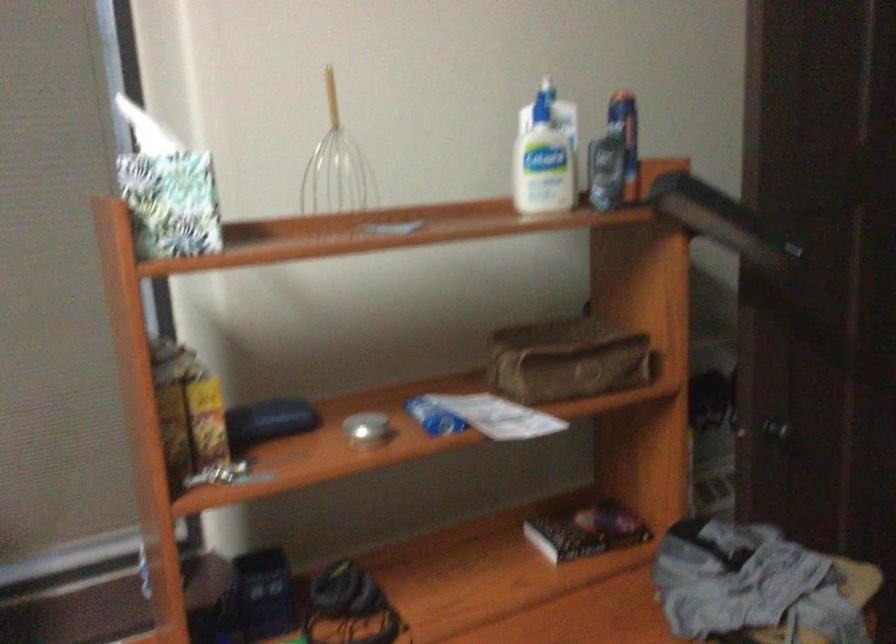
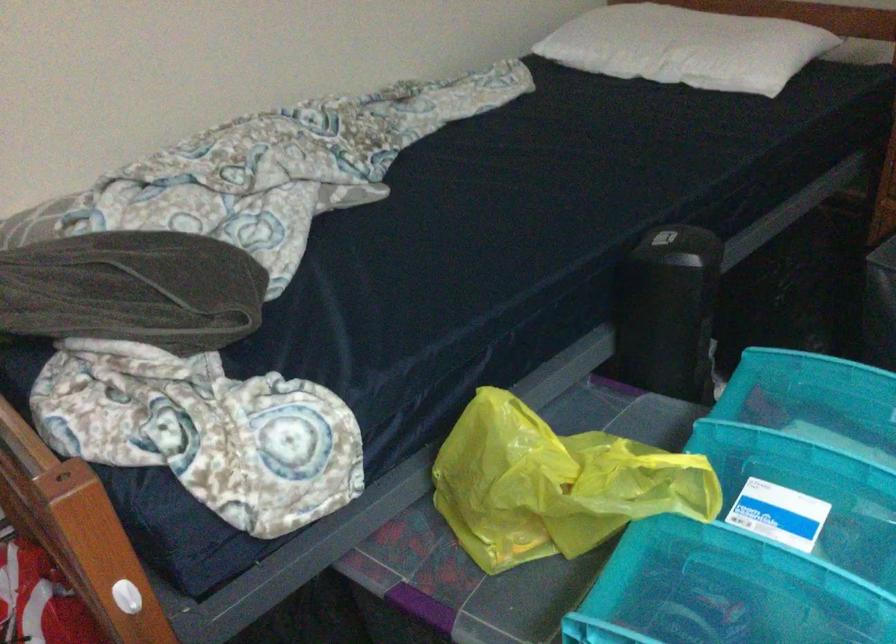
First-person continuous shooting, in which direction is the camera rotating?

The camera rotated toward right-down.